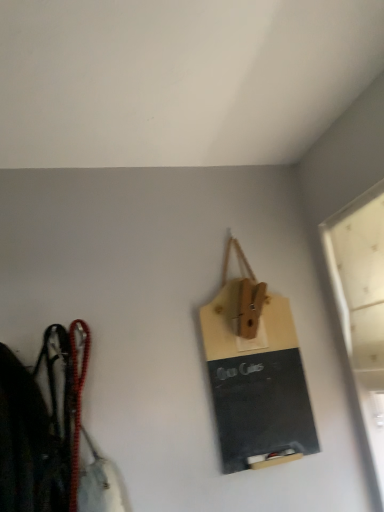
Question: Is matte black chalkboard at center to the left of white frosted glass window at upper right from the viewer's perspective?

Choices:
 (A) yes
 (B) no

Answer: (A)

Question: Is matte black chalkboard at center aimed at white frosted glass window at upper right?

Choices:
 (A) yes
 (B) no

Answer: (B)

Question: Does matte black chalkboard at center have a greater height compared to white frosted glass window at upper right?

Choices:
 (A) yes
 (B) no

Answer: (B)

Question: Does matte black chalkboard at center have a greater width compared to white frosted glass window at upper right?

Choices:
 (A) no
 (B) yes

Answer: (A)

Question: Are matte black chalkboard at center and white frosted glass window at upper right far apart?

Choices:
 (A) yes
 (B) no

Answer: (B)

Question: From the image's perspective, is matte black chalkboard at center beneath white frosted glass window at upper right?

Choices:
 (A) no
 (B) yes

Answer: (B)

Question: From the image's perspective, is white frosted glass window at upper right located beneath matte black chalkboard at center?

Choices:
 (A) yes
 (B) no

Answer: (B)

Question: Is white frosted glass window at upper right far from matte black chalkboard at center?

Choices:
 (A) no
 (B) yes

Answer: (A)

Question: Is white frosted glass window at upper right taller than matte black chalkboard at center?

Choices:
 (A) yes
 (B) no

Answer: (A)

Question: Considering the relative positions of white frosted glass window at upper right and matte black chalkboard at center in the image provided, is white frosted glass window at upper right to the left of matte black chalkboard at center from the viewer's perspective?

Choices:
 (A) yes
 (B) no

Answer: (B)

Question: From a real-world perspective, is white frosted glass window at upper right located beneath matte black chalkboard at center?

Choices:
 (A) yes
 (B) no

Answer: (A)

Question: Considering the relative sizes of white frosted glass window at upper right and matte black chalkboard at center in the image provided, is white frosted glass window at upper right thinner than matte black chalkboard at center?

Choices:
 (A) yes
 (B) no

Answer: (B)

Question: Considering the positions of point (256, 458) and point (374, 214), is point (256, 458) closer or farther from the camera than point (374, 214)?

Choices:
 (A) farther
 (B) closer

Answer: (A)